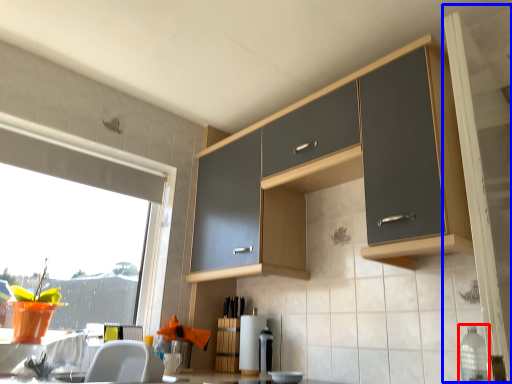
Question: Which object appears farthest to the camera in this image, bottle (highlighted by a red box) or screen door (highlighted by a blue box)?

Choices:
 (A) bottle
 (B) screen door

Answer: (A)